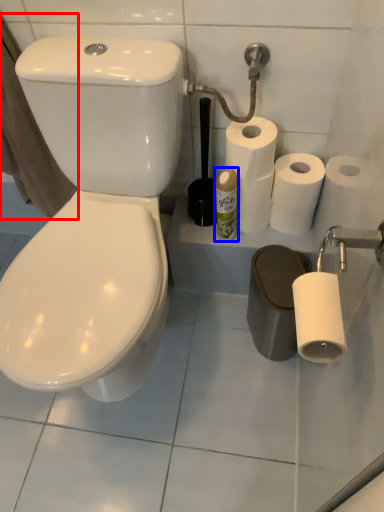
Question: Which object appears farthest to the camera in this image, bath towel (highlighted by a red box) or cleaning product (highlighted by a blue box)?

Choices:
 (A) bath towel
 (B) cleaning product

Answer: (B)